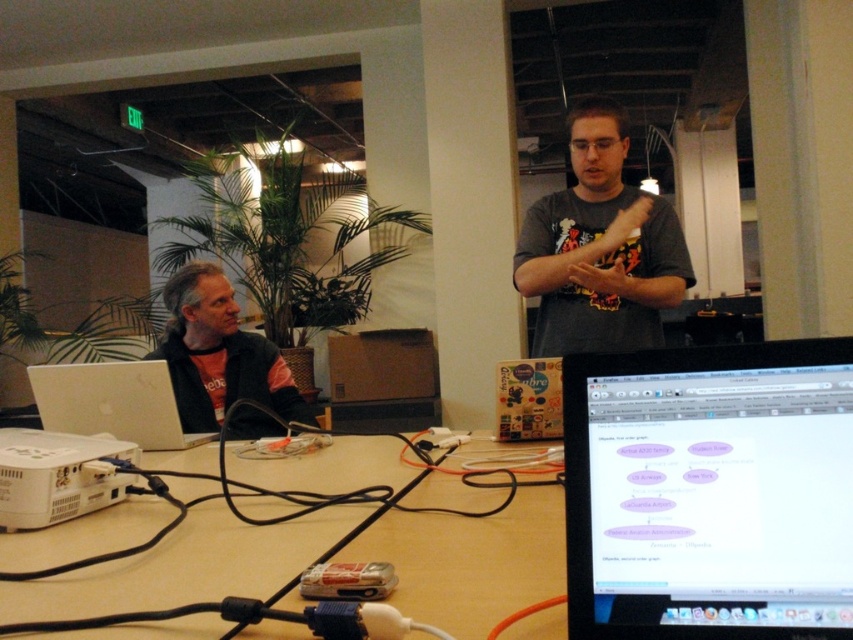
Is point (538, 236) closer to viewer compared to point (219, 280)?

Yes, point (538, 236) is in front of point (219, 280).

The height and width of the screenshot is (640, 853). I want to click on gray matte t-shirt at center, so click(599, 248).

Is black glossy monitor at center right shorter than matte black jacket at left?

Indeed, black glossy monitor at center right has a lesser height compared to matte black jacket at left.

Is black glossy monitor at center right thinner than matte black jacket at left?

Indeed, black glossy monitor at center right has a lesser width compared to matte black jacket at left.

Who is more forward, (653, 436) or (177, 336)?

Point (653, 436)

What are the coordinates of `black glossy monitor at center right` in the screenshot? It's located at (709, 492).

Does point (193, 428) come closer to viewer compared to point (178, 432)?

No, it is not.

Which of these two, matte black jacket at left or silver metallic laptop at left, stands shorter?

silver metallic laptop at left

Who is more distant from viewer, (195, 266) or (112, 390)?

Point (195, 266)

The image size is (853, 640). In order to click on matte black jacket at left in this screenshot , I will do `click(219, 355)`.